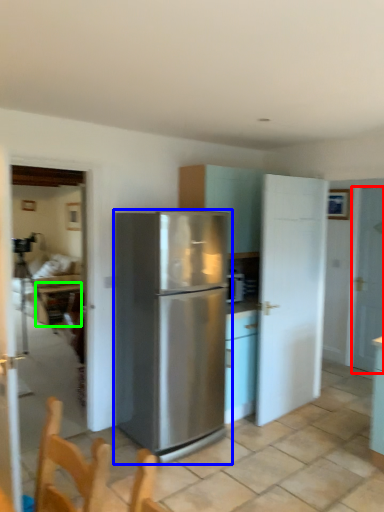
Question: Which object is the farthest from door (highlighted by a red box)? Choose among these: refrigerator (highlighted by a blue box) or table (highlighted by a green box).

Choices:
 (A) refrigerator
 (B) table

Answer: (B)